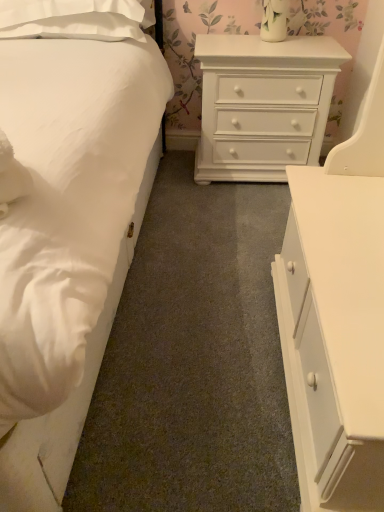
Question: Is white painted wood chest of drawers at center, arranged as the second chest of drawers when viewed from the front, wider or thinner than white soft pillow at upper left?

Choices:
 (A) thin
 (B) wide

Answer: (A)

Question: In terms of size, does white painted wood chest of drawers at center, arranged as the 1th chest of drawers when viewed from the back, appear bigger or smaller than white soft pillow at upper left?

Choices:
 (A) big
 (B) small

Answer: (A)

Question: Considering the real-world distances, which object is farthest from the white smooth bed at left?

Choices:
 (A) white glossy chest of drawers at upper center, which ranks as the first chest of drawers in front-to-back order
 (B) white painted wood chest of drawers at center, arranged as the second chest of drawers when viewed from the front
 (C) white soft pillow at upper left

Answer: (B)

Question: Considering the real-world distances, which object is farthest from the white glossy chest of drawers at upper center, the second chest of drawers from the back?

Choices:
 (A) white soft pillow at upper left
 (B) white painted wood chest of drawers at center, arranged as the 1th chest of drawers when viewed from the back
 (C) white smooth bed at left

Answer: (A)